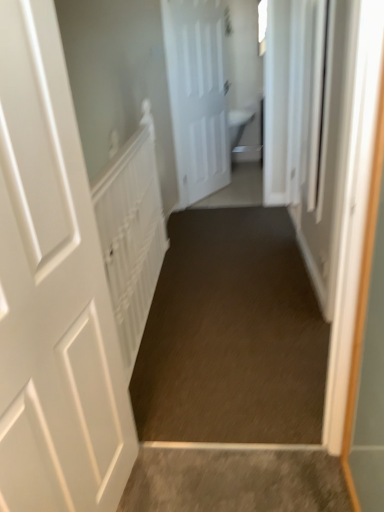
Question: Is white textured radiator at left wider than white matte door at center, positioned as the 2th door in bottom-to-top order?

Choices:
 (A) no
 (B) yes

Answer: (B)

Question: Is white textured radiator at left far from white matte door at center, placed as the first door when sorted from top to bottom?

Choices:
 (A) yes
 (B) no

Answer: (A)

Question: Considering the relative sizes of white textured radiator at left and white matte door at center, which ranks as the 2th door in front-to-back order, in the image provided, is white textured radiator at left thinner than white matte door at center, which ranks as the 2th door in front-to-back order,?

Choices:
 (A) no
 (B) yes

Answer: (A)

Question: Is white textured radiator at left to the right of white matte door at center, acting as the 1th door starting from the back, from the viewer's perspective?

Choices:
 (A) yes
 (B) no

Answer: (B)

Question: Is white matte door at center, positioned as the 2th door in bottom-to-top order, at the back of white textured radiator at left?

Choices:
 (A) yes
 (B) no

Answer: (B)

Question: Considering their positions, is white matte door at left, which ranks as the second door in top-to-bottom order, located in front of or behind brown carpet at center?

Choices:
 (A) front
 (B) behind

Answer: (A)

Question: Is white matte door at left, placed as the first door when sorted from left to right, situated inside brown carpet at center or outside?

Choices:
 (A) inside
 (B) outside

Answer: (B)

Question: Is point (31, 505) positioned closer to the camera than point (168, 364)?

Choices:
 (A) farther
 (B) closer

Answer: (B)

Question: Looking at their shapes, would you say white matte door at left, the 2th door viewed from the right, is wider or thinner than brown carpet at center?

Choices:
 (A) wide
 (B) thin

Answer: (B)

Question: In terms of width, does white textured radiator at left look wider or thinner when compared to white matte door at center, acting as the 1th door starting from the back?

Choices:
 (A) wide
 (B) thin

Answer: (A)

Question: From the image's perspective, is white textured radiator at left located above or below white matte door at center, acting as the 1th door starting from the back?

Choices:
 (A) above
 (B) below

Answer: (B)

Question: Do you think white textured radiator at left is within white matte door at center, which appears as the 2th door when viewed from the left, or outside of it?

Choices:
 (A) outside
 (B) inside

Answer: (A)

Question: In terms of height, does white textured radiator at left look taller or shorter compared to white matte door at center, positioned as the 2th door in bottom-to-top order?

Choices:
 (A) short
 (B) tall

Answer: (A)

Question: Is white matte door at center, which is the first door from right to left, spatially inside white textured radiator at left, or outside of it?

Choices:
 (A) outside
 (B) inside

Answer: (A)

Question: Does point (203, 188) appear closer or farther from the camera than point (117, 159)?

Choices:
 (A) closer
 (B) farther

Answer: (B)